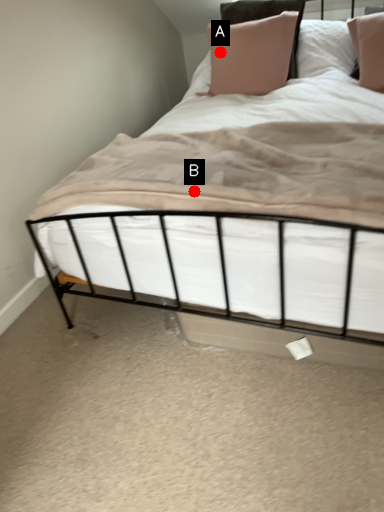
Question: Two points are circled on the image, labeled by A and B beside each circle. Among these points, which one is nearest to the camera?

Choices:
 (A) A is closer
 (B) B is closer

Answer: (B)